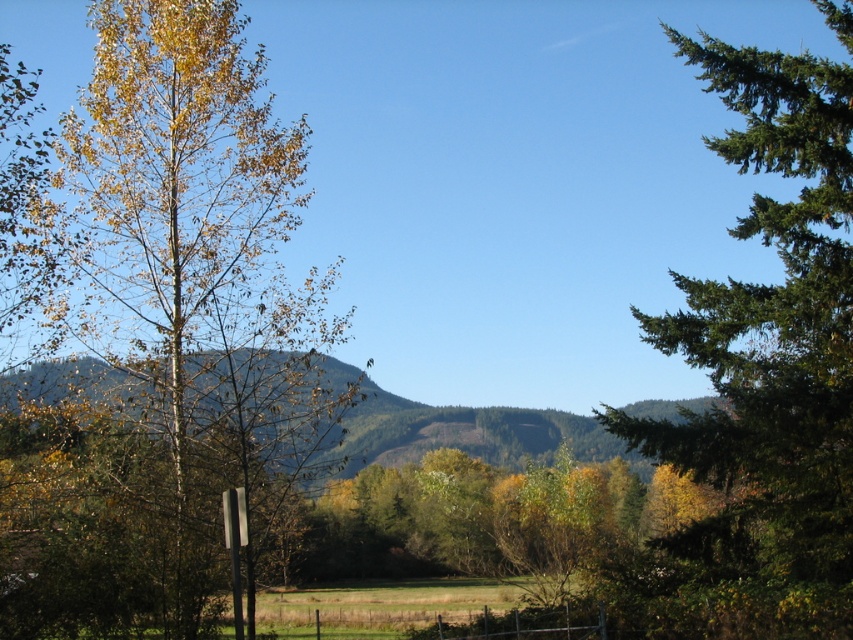
You are standing at the viewpoint in the image and want to walk towards the point labeled as point (x=213, y=150). Will you pass by point (x=563, y=428) on your way there?

No, because point (x=213, y=150) is in front of point (x=563, y=428), so you would reach point (x=213, y=150) before reaching point (x=563, y=428).